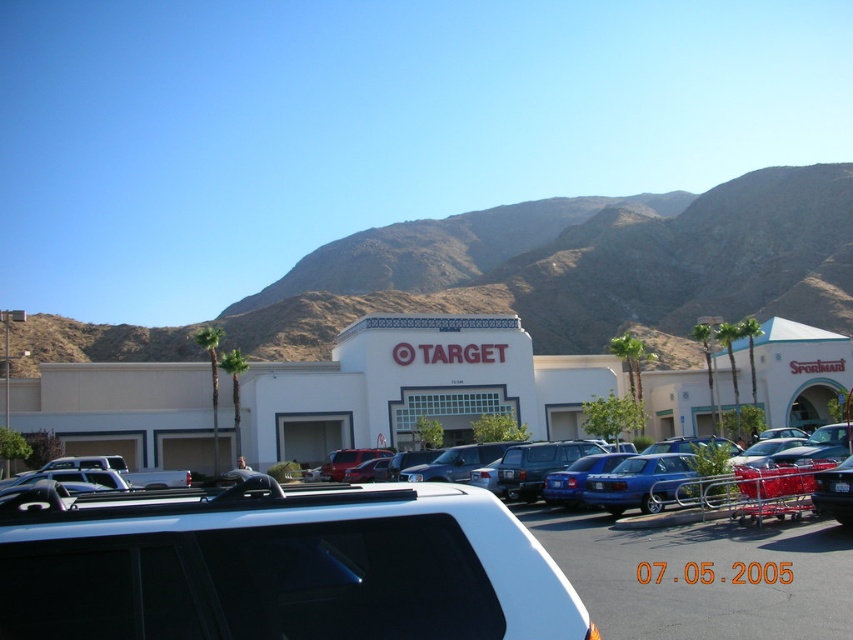
Question: Which point is closer to the camera?

Choices:
 (A) white plastic car at center
 (B) brown rocky mountain at upper center
 (C) blue metallic sedan at center

Answer: (A)

Question: Which of the following is the farthest from the observer?

Choices:
 (A) brown rocky mountain at upper center
 (B) white plastic car at center

Answer: (A)

Question: Is the position of white plastic car at center less distant than that of blue metallic sedan at center?

Choices:
 (A) no
 (B) yes

Answer: (B)

Question: Does white plastic car at center have a lesser width compared to blue metallic sedan at center?

Choices:
 (A) no
 (B) yes

Answer: (A)

Question: Is white plastic car at center wider than brown rocky mountain at upper center?

Choices:
 (A) no
 (B) yes

Answer: (A)

Question: Based on their relative distances, which object is nearer to the white plastic car at center?

Choices:
 (A) brown rocky mountain at upper center
 (B) blue metallic sedan at center

Answer: (B)